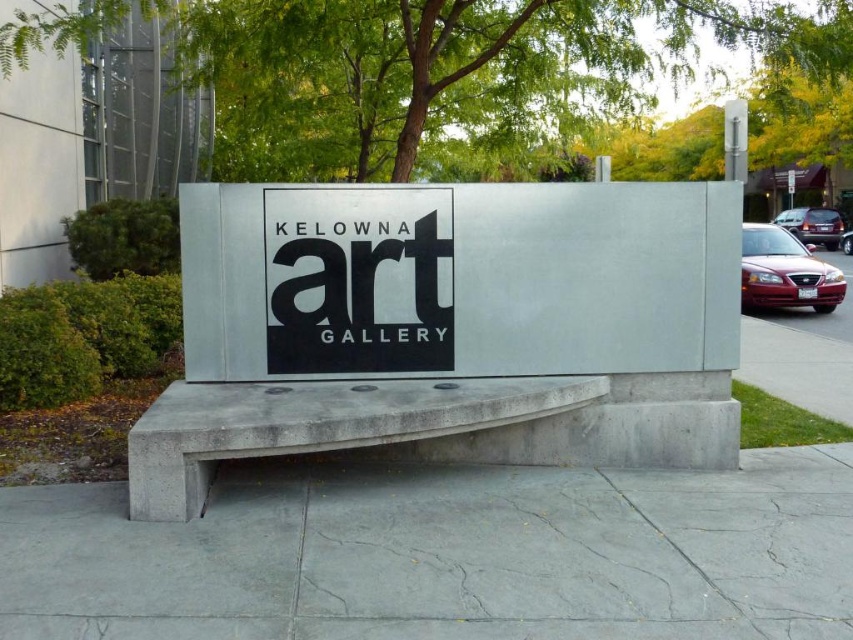
Does gray concrete bench at center have a smaller size compared to matte red car at right?

Correct, gray concrete bench at center occupies less space than matte red car at right.

Does point (184, 500) lie behind point (822, 273)?

No, it is not.

Image resolution: width=853 pixels, height=640 pixels. Identify the location of gray concrete bench at center. (315, 424).

Where is `gray concrete bench at center`? gray concrete bench at center is located at coordinates (315, 424).

Which of these two, white concrete sign at center or matte red car at right, stands shorter?

With less height is white concrete sign at center.

Does point (553, 321) come behind point (793, 291)?

No.

Does point (674, 221) lie behind point (757, 289)?

No, it is not.

Identify the location of white concrete sign at center. (457, 278).

Is white concrete sign at center smaller than gray concrete bench at center?

Yes, white concrete sign at center is smaller than gray concrete bench at center.

From the picture: Can you confirm if white concrete sign at center is wider than gray concrete bench at center?

Yes, white concrete sign at center is wider than gray concrete bench at center.

Image resolution: width=853 pixels, height=640 pixels. What do you see at coordinates (457, 278) in the screenshot?
I see `white concrete sign at center` at bounding box center [457, 278].

You are a GUI agent. You are given a task and a screenshot of the screen. Output one action in this format:
    pyautogui.click(x=<x>, y=<y>)
    Task: Click on the white concrete sign at center
    
    Given the screenshot: What is the action you would take?
    pyautogui.click(x=457, y=278)